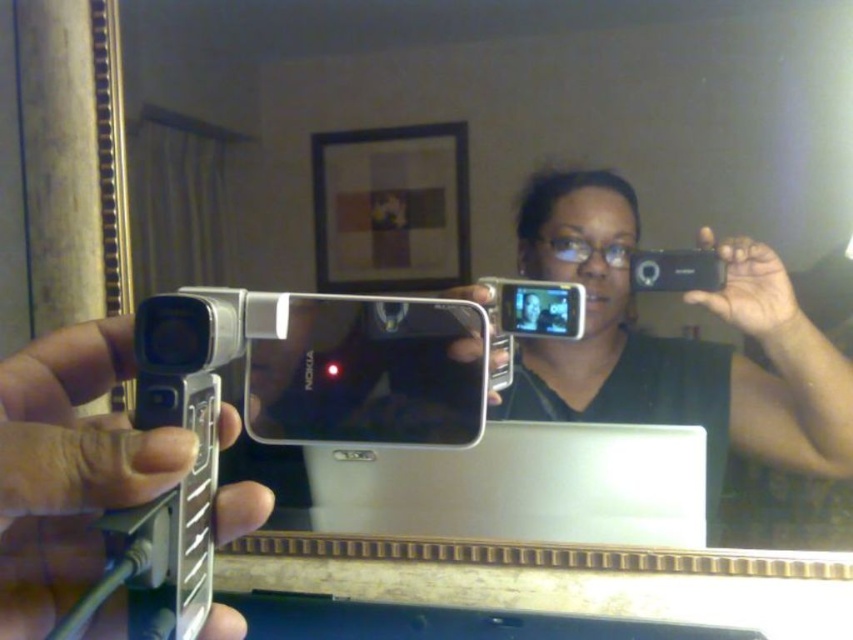
Question: Does matte black camera at upper right appear on the left side of matte black camera at upper center?

Choices:
 (A) yes
 (B) no

Answer: (B)

Question: Which point is closer to the camera?

Choices:
 (A) silver metallic nokia camera at center
 (B) matte black camera at upper right
 (C) matte black camera at upper center

Answer: (A)

Question: Estimate the real-world distances between objects in this image. Which object is closer to the matte black camera at upper center?

Choices:
 (A) silver metallic laptop at center
 (B) silver metallic phone at lower left

Answer: (A)

Question: Which of the following is the closest to the observer?

Choices:
 (A) silver metallic nokia camera at center
 (B) silver metallic laptop at center
 (C) silver metallic phone at lower left
 (D) matte black camera at upper center

Answer: (C)

Question: Is silver metallic nokia camera at center wider than matte black camera at upper right?

Choices:
 (A) yes
 (B) no

Answer: (A)

Question: In this image, where is silver metallic nokia camera at center located relative to silver metallic phone at lower left?

Choices:
 (A) left
 (B) right

Answer: (B)